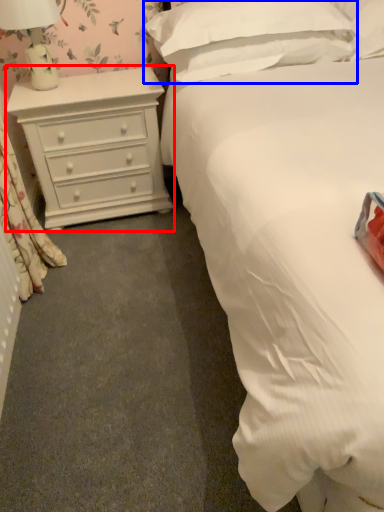
Question: Which object appears farthest to the camera in this image, chest of drawers (highlighted by a red box) or pillow (highlighted by a blue box)?

Choices:
 (A) chest of drawers
 (B) pillow

Answer: (A)